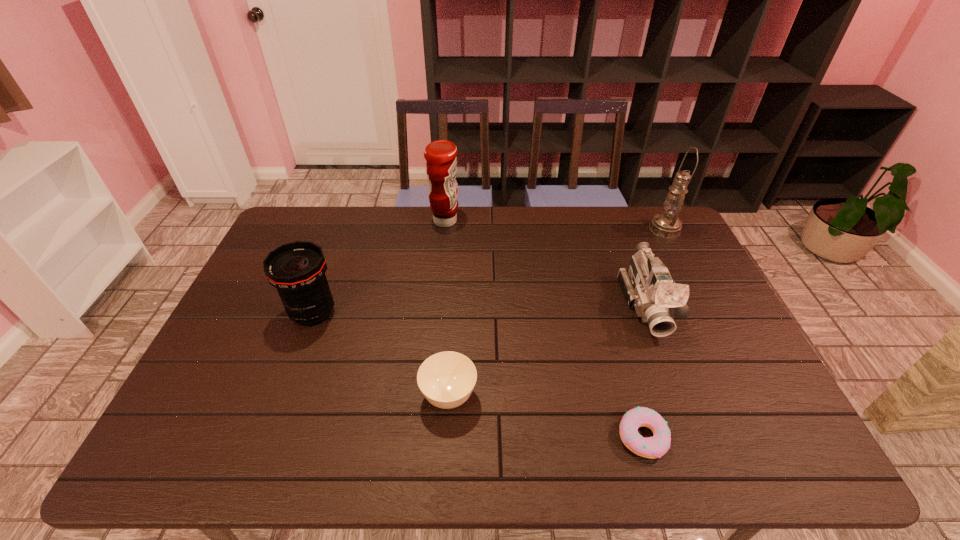
Where is `free location located on the front-facing side of the fifth object from left to right`? The image size is (960, 540). free location located on the front-facing side of the fifth object from left to right is located at coordinates (698, 441).

Image resolution: width=960 pixels, height=540 pixels. I want to click on blank space located 0.140m on the right of the second shortest object, so click(533, 396).

Where is `free point located 0.160m on the left of the shortest object`? free point located 0.160m on the left of the shortest object is located at coordinates (548, 436).

The width and height of the screenshot is (960, 540). Find the location of `oil lamp situated at the far edge`. oil lamp situated at the far edge is located at coordinates (667, 224).

Locate an element on the screen. The width and height of the screenshot is (960, 540). condiment present at the far edge is located at coordinates (441, 163).

You are a GUI agent. You are given a task and a screenshot of the screen. Output one action in this format:
    pyautogui.click(x=<x>, y=<y>)
    Task: Click on the object that is positioned at the near edge
    The width and height of the screenshot is (960, 540).
    Given the screenshot: What is the action you would take?
    pyautogui.click(x=653, y=447)

Locate an element on the screen. Image resolution: width=960 pixels, height=540 pixels. object that is positioned at the left edge is located at coordinates (297, 270).

The width and height of the screenshot is (960, 540). Find the location of `object that is at the right edge`. object that is at the right edge is located at coordinates (667, 224).

Locate an element on the screen. The width and height of the screenshot is (960, 540). object situated at the far right corner is located at coordinates (667, 224).

The image size is (960, 540). Identify the location of free location at the far edge. (475, 241).